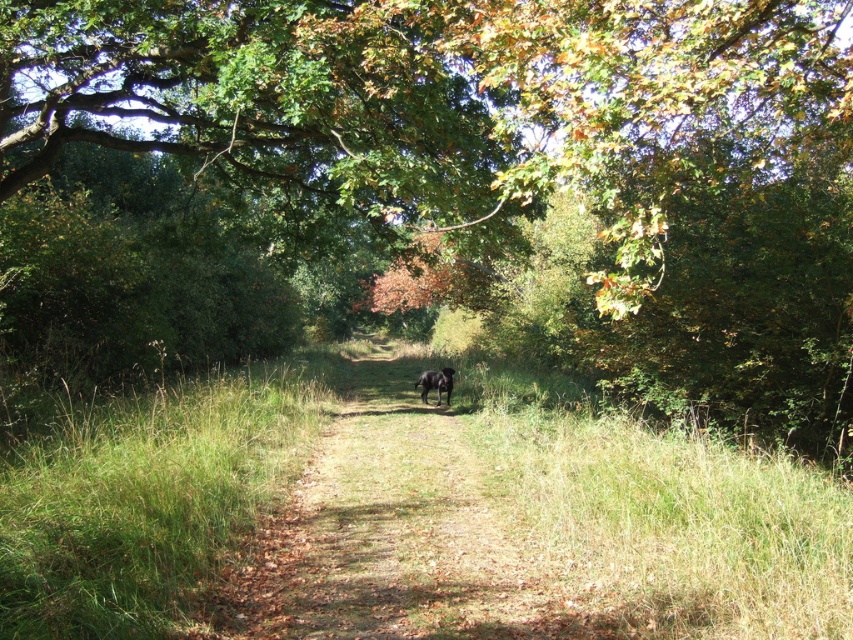
Looking at this image, you are standing at the start of the forest path and want to take a photo of the green leafy tree at center. Based on its 2D coordinates, where should you position yourself to ensure the tree is centered in your camera frame?

To center the green leafy tree at center in your camera frame, position yourself such that the tree is aligned with the center point of your viewfinder at coordinates approximately 0.245 on the x and 0.604 on the y axis.